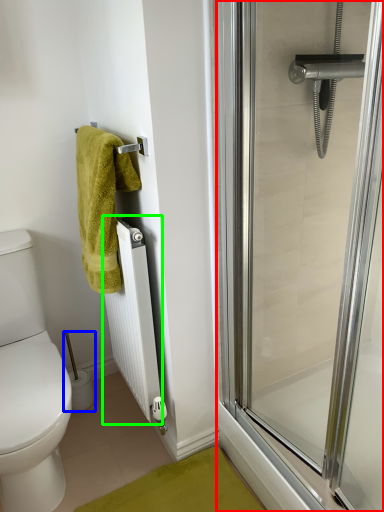
Question: Which object is positioned farthest from screen door (highlighted by a red box)? Select from toilet paper (highlighted by a blue box) and radiator (highlighted by a green box).

Choices:
 (A) toilet paper
 (B) radiator

Answer: (A)